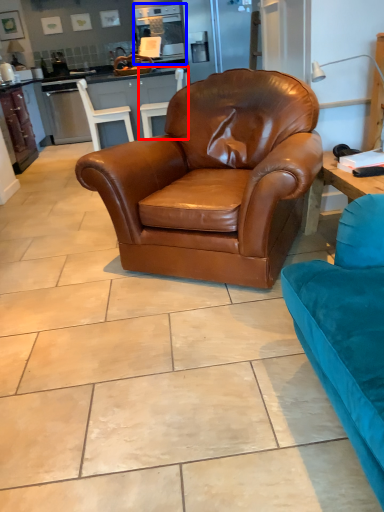
Question: Which point is closer to the camera, chair (highlighted by a red box) or appliance (highlighted by a blue box)?

Choices:
 (A) chair
 (B) appliance

Answer: (A)